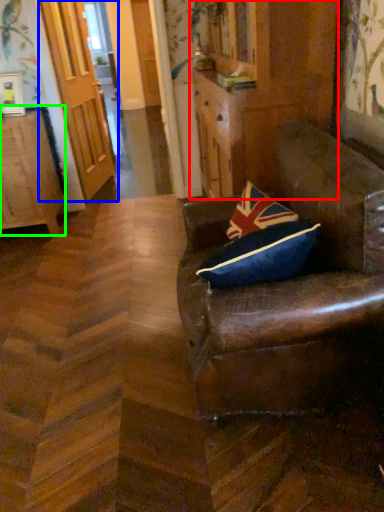
Question: Which object is positioned closest to dresser (highlighted by a red box)? Select from door (highlighted by a blue box) and cabinetry (highlighted by a green box).

Choices:
 (A) door
 (B) cabinetry

Answer: (B)